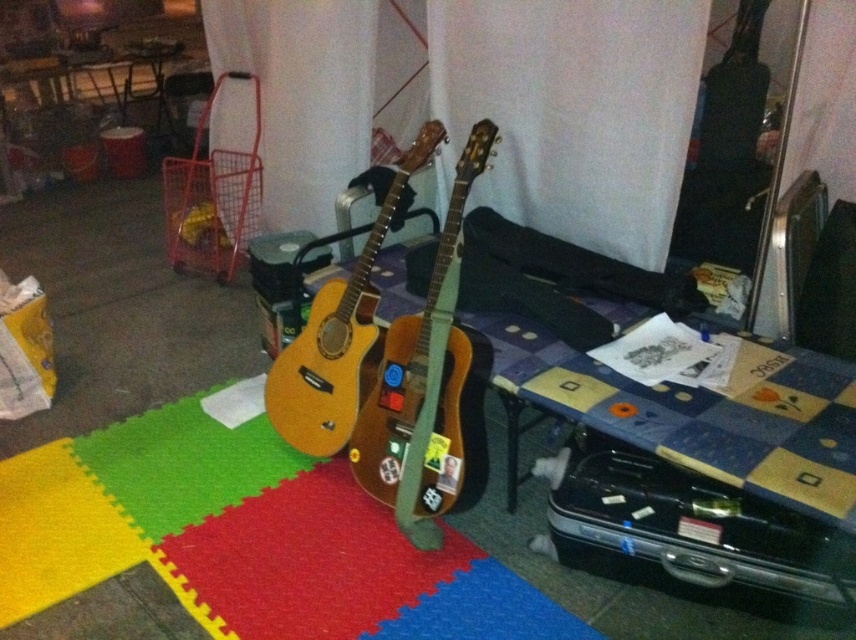
Can you confirm if black hard case at lower right is positioned to the left of wooden acoustic guitar at center?

Incorrect, black hard case at lower right is not on the left side of wooden acoustic guitar at center.

The image size is (856, 640). Describe the element at coordinates (688, 528) in the screenshot. I see `black hard case at lower right` at that location.

The width and height of the screenshot is (856, 640). What do you see at coordinates (688, 528) in the screenshot? I see `black hard case at lower right` at bounding box center [688, 528].

Locate an element on the screen. Image resolution: width=856 pixels, height=640 pixels. black hard case at lower right is located at coordinates (688, 528).

Is black hard case at lower right bigger than yellow matte acoustic guitar at center?

Incorrect, black hard case at lower right is not larger than yellow matte acoustic guitar at center.

Is point (682, 547) positioned before point (292, 362)?

Yes, point (682, 547) is closer to viewer.

Measure the distance between point (721, 573) and camera.

Point (721, 573) is 4.90 feet from camera.

Find the location of a particular element. This screenshot has height=640, width=856. black hard case at lower right is located at coordinates (688, 528).

Who is more forward, (456,368) or (311,324)?

Point (456,368) is more forward.

Which is more to the right, wooden acoustic guitar at center or yellow matte acoustic guitar at center?

wooden acoustic guitar at center is more to the right.

Which is behind, point (474, 124) or point (364, 280)?

The point (474, 124) is behind.

Find the location of a particular element. wooden acoustic guitar at center is located at coordinates tap(414, 344).